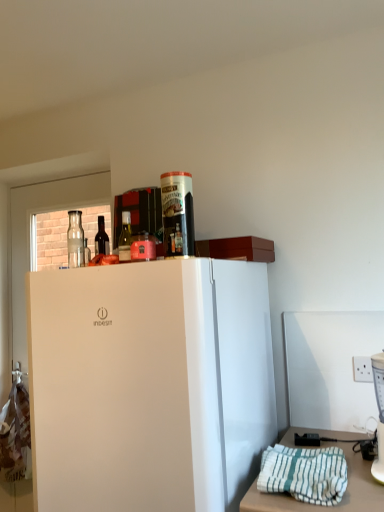
Find the location of a particular element. This screenshot has height=512, width=384. white matte refrigerator at center is located at coordinates [x=150, y=385].

Image resolution: width=384 pixels, height=512 pixels. What do you see at coordinates (150, 385) in the screenshot?
I see `white matte refrigerator at center` at bounding box center [150, 385].

What is the approximate height of matte glass bottle at upper center, the second bottle positioned from the back?

6.36 inches.

The width and height of the screenshot is (384, 512). Describe the element at coordinates (30, 236) in the screenshot. I see `transparent glass door at upper left` at that location.

Locate an element on the screen. This screenshot has height=512, width=384. white plastic blender at right is located at coordinates (379, 414).

Between dark glass bottle at upper left, arranged as the 1th bottle when viewed from the left, and matte glass bottle at upper center, the second bottle positioned from the back, which one is positioned in front?

matte glass bottle at upper center, the second bottle positioned from the back, is more forward.

Who is shorter, dark glass bottle at upper left, the 2th bottle viewed from the front, or matte glass bottle at upper center, arranged as the first bottle when viewed from the right?

matte glass bottle at upper center, arranged as the first bottle when viewed from the right, is shorter.

Is point (102, 249) farther from camera compared to point (127, 255)?

Yes.

Is white plastic blender at right turned away from dark glass bottle at upper left, positioned as the 2th bottle in right-to-left order?

No, white plastic blender at right is not facing away from dark glass bottle at upper left, positioned as the 2th bottle in right-to-left order.

Which object is further away from the camera, white plastic blender at right or dark glass bottle at upper left, the 2th bottle viewed from the front?

dark glass bottle at upper left, the 2th bottle viewed from the front.

Is white plastic blender at right to the right of dark glass bottle at upper left, arranged as the 1th bottle when viewed from the left, from the viewer's perspective?

Correct, you'll find white plastic blender at right to the right of dark glass bottle at upper left, arranged as the 1th bottle when viewed from the left.

This screenshot has width=384, height=512. I want to click on refrigerator below the transparent glass door at upper left (from a real-world perspective), so click(x=150, y=385).

From the image's perspective, is transparent glass door at upper left over white matte refrigerator at center?

Correct, transparent glass door at upper left appears higher than white matte refrigerator at center in the image.

Consider the image. Which of these two, transparent glass door at upper left or white matte refrigerator at center, is wider?

With larger width is white matte refrigerator at center.

Is transparent glass door at upper left facing towards white matte refrigerator at center?

No, transparent glass door at upper left does not turn towards white matte refrigerator at center.

Is white matte refrigerator at center not close to white plastic blender at right?

No, there isn't a large distance between white matte refrigerator at center and white plastic blender at right.

Which of these two, white matte refrigerator at center or white plastic blender at right, is thinner?

Thinner between the two is white plastic blender at right.

Does point (84, 509) appear closer or farther from the camera than point (376, 355)?

Point (84, 509).

Is white plastic blender at right wider or thinner than transparent glass door at upper left?

white plastic blender at right is wider than transparent glass door at upper left.

Looking at this image, which point is more forward, (383,382) or (14,266)?

The point (383,382) is closer to the camera.

Is white plastic blender at right facing away from transparent glass door at upper left?

No, white plastic blender at right is not facing away from transparent glass door at upper left.

From the image's perspective, is white plastic blender at right on transparent glass door at upper left?

Yes, from the image's perspective, white plastic blender at right is on top of transparent glass door at upper left.

The image size is (384, 512). Identify the location of appliance above the white striped towel at lower right (from the image's perspective). click(379, 414).

Is white plastic blender at right in front of or behind white striped towel at lower right in the image?

Visually, white plastic blender at right is located behind white striped towel at lower right.

Based on the photo, who is shorter, white plastic blender at right or white striped towel at lower right?

white striped towel at lower right.

Between transparent glass door at upper left and white striped towel at lower right, which one has larger size?

Bigger between the two is transparent glass door at upper left.

From a real-world perspective, between transparent glass door at upper left and white striped towel at lower right, who is vertically lower?

In real-world perspective, white striped towel at lower right is lower.

Considering the positions of objects transparent glass door at upper left and white striped towel at lower right in the image provided, who is more to the right, transparent glass door at upper left or white striped towel at lower right?

Positioned to the right is white striped towel at lower right.

Between transparent glass door at upper left and white striped towel at lower right, which one has more height?

transparent glass door at upper left.

Where is `bottle that is in front of the dark glass bottle at upper left, acting as the 1th bottle starting from the back`? bottle that is in front of the dark glass bottle at upper left, acting as the 1th bottle starting from the back is located at coordinates (125, 237).

Locate an element on the screen. The image size is (384, 512). the 2nd bottle to the left of the white plastic blender at right, starting your count from the anchor is located at coordinates (101, 238).

From the image, which object appears to be nearer to matte glass bottle at upper center, marked as the 1th bottle in a front-to-back arrangement, transparent glass door at upper left or white striped towel at lower right?

white striped towel at lower right lies closer to matte glass bottle at upper center, marked as the 1th bottle in a front-to-back arrangement, than the other object.

Which object lies nearer to the anchor point white striped towel at lower right, matte glass bottle at upper center, arranged as the first bottle when viewed from the right, or dark glass bottle at upper left, arranged as the 1th bottle when viewed from the left?

Among the two, matte glass bottle at upper center, arranged as the first bottle when viewed from the right, is located nearer to white striped towel at lower right.

Considering their positions, is white striped towel at lower right positioned closer to white matte refrigerator at center than dark glass bottle at upper left, arranged as the 1th bottle when viewed from the left?

white striped towel at lower right.

When comparing their distances from transparent glass door at upper left, does white matte refrigerator at center or dark glass bottle at upper left, the 2th bottle viewed from the front, seem further?

white matte refrigerator at center is positioned further to the anchor transparent glass door at upper left.

Looking at the image, which one is located further to transparent glass door at upper left, white plastic blender at right or white striped towel at lower right?

white plastic blender at right is positioned further to the anchor transparent glass door at upper left.

When comparing their distances from white striped towel at lower right, does white matte refrigerator at center or transparent glass door at upper left seem closer?

white matte refrigerator at center.

Looking at the image, which one is located further to white plastic blender at right, matte glass bottle at upper center, arranged as the first bottle when viewed from the right, or dark glass bottle at upper left, acting as the 1th bottle starting from the back?

dark glass bottle at upper left, acting as the 1th bottle starting from the back, is further to white plastic blender at right.

Which object lies nearer to the anchor point white plastic blender at right, dark glass bottle at upper left, the 2th bottle viewed from the front, or transparent glass door at upper left?

Among the two, dark glass bottle at upper left, the 2th bottle viewed from the front, is located nearer to white plastic blender at right.

Where is `refrigerator between dark glass bottle at upper left, positioned as the 2th bottle in right-to-left order, and white striped towel at lower right vertically`? The height and width of the screenshot is (512, 384). refrigerator between dark glass bottle at upper left, positioned as the 2th bottle in right-to-left order, and white striped towel at lower right vertically is located at coordinates (150, 385).

You are a GUI agent. You are given a task and a screenshot of the screen. Output one action in this format:
    pyautogui.click(x=<x>, y=<y>)
    Task: Click on the refrigerator between matte glass bottle at upper center, which is counted as the second bottle, starting from the left, and white plastic blender at right from left to right
    The width and height of the screenshot is (384, 512).
    Given the screenshot: What is the action you would take?
    pyautogui.click(x=150, y=385)

Where is `bottle between dark glass bottle at upper left, positioned as the 2th bottle in right-to-left order, and white plastic blender at right, in the horizontal direction`? Image resolution: width=384 pixels, height=512 pixels. bottle between dark glass bottle at upper left, positioned as the 2th bottle in right-to-left order, and white plastic blender at right, in the horizontal direction is located at coordinates (125, 237).

You are a GUI agent. You are given a task and a screenshot of the screen. Output one action in this format:
    pyautogui.click(x=<x>, y=<y>)
    Task: Click on the blanket between white matte refrigerator at center and transparent glass door at upper left along the z-axis
    The width and height of the screenshot is (384, 512).
    Given the screenshot: What is the action you would take?
    pyautogui.click(x=304, y=473)